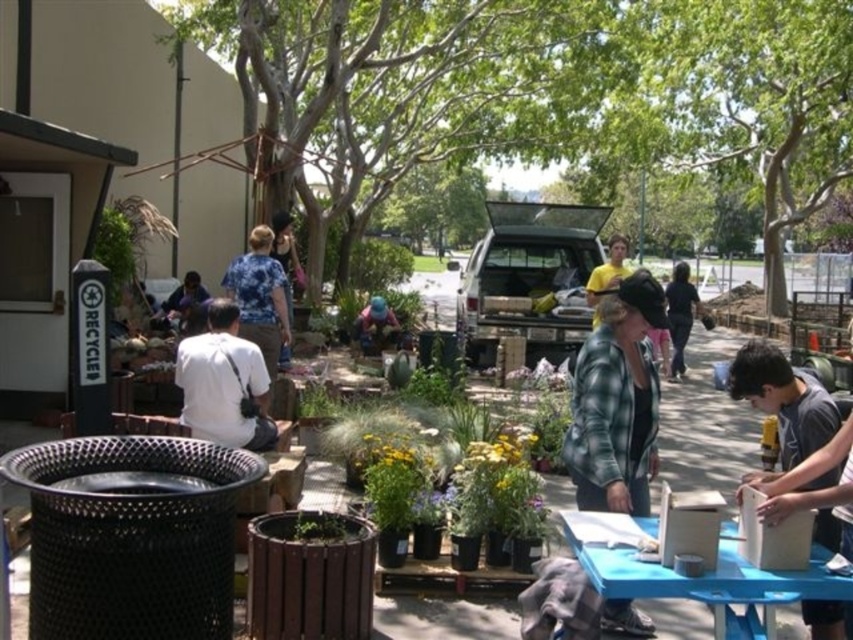
You are organizing a community event and need to place a large banner between the blue plastic table at lower right and the white matte shirt at center. Which object should the banner be placed closer to if you want it to be more visible to people entering from the left side of the scene?

The banner should be placed closer to the white matte shirt at center because it is larger than the blue plastic table at lower right, making it a better focal point for visibility.

You are standing at the picnic table and want to hand a gardening tool to both the person wearing the green plaid jacket at center and the person wearing the yellow cotton shirt at center. Which person is closer to you?

The green plaid jacket at center is 17.50 feet away from the yellow cotton shirt at center. Since both are at the center, it is unclear which is closer without additional spatial information. Please check their exact positions relative to the picnic table.